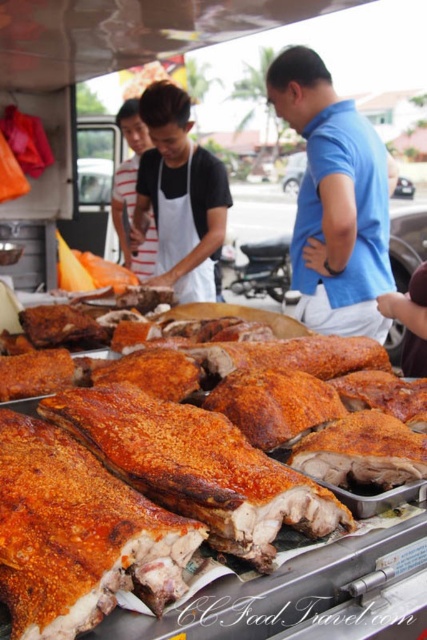
What is the object located at the coordinates point [175,211] in the image?

The object located at point [175,211] is the white fabric apron at center.

You are a customer at the food stall and you want to identify the person wearing the blue cotton shirt at center. How can you distinguish them from the person wearing the white fabric apron at center based on their clothing height?

The blue cotton shirt at center has a greater height compared to the white fabric apron at center, so the person wearing the blue cotton shirt at center will have taller clothing than the one with the white fabric apron at center.